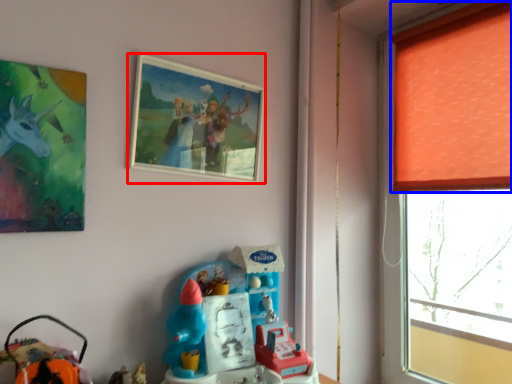
Question: Which object is closer to the camera taking this photo, picture frame (highlighted by a red box) or curtain (highlighted by a blue box)?

Choices:
 (A) picture frame
 (B) curtain

Answer: (A)